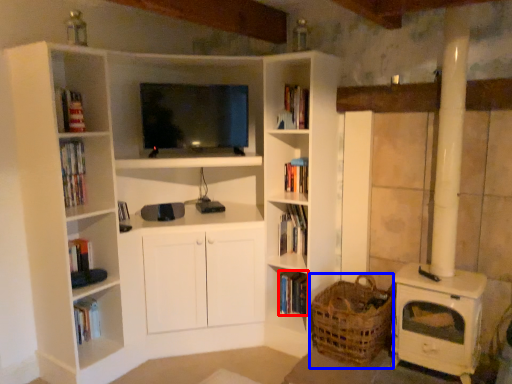
Question: Which object appears farthest to the camera in this image, book (highlighted by a red box) or basket (highlighted by a blue box)?

Choices:
 (A) book
 (B) basket

Answer: (A)